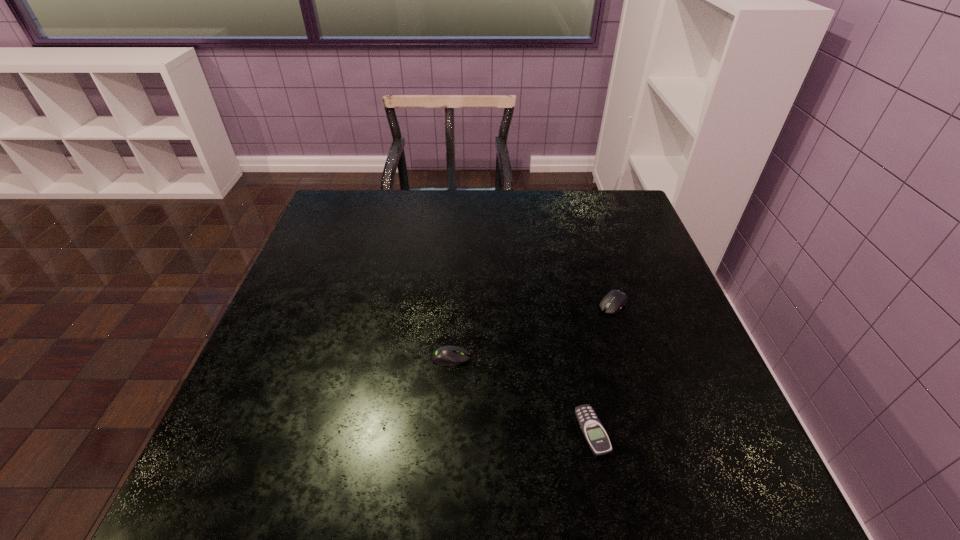
The image size is (960, 540). I want to click on free space between the nearest object and the rightmost object, so click(x=603, y=368).

Where is `unoccupied area between the second farthest object and the nearest object`? Image resolution: width=960 pixels, height=540 pixels. unoccupied area between the second farthest object and the nearest object is located at coordinates (521, 395).

The image size is (960, 540). Find the location of `free space between the leftmost object and the beeper`. free space between the leftmost object and the beeper is located at coordinates (521, 395).

Where is `free space between the leftmost object and the second object from right to left`? free space between the leftmost object and the second object from right to left is located at coordinates (521, 395).

The width and height of the screenshot is (960, 540). In order to click on free area in between the rightmost object and the second nearest object in this screenshot , I will do `click(532, 331)`.

The width and height of the screenshot is (960, 540). Find the location of `unoccupied position between the right computer mouse and the second nearest object`. unoccupied position between the right computer mouse and the second nearest object is located at coordinates (532, 331).

Locate an element on the screen. vacant area that lies between the second nearest object and the farthest object is located at coordinates (532, 331).

The image size is (960, 540). In order to click on empty space between the beeper and the left computer mouse in this screenshot , I will do `click(521, 395)`.

Locate an element on the screen. Image resolution: width=960 pixels, height=540 pixels. object that is the second nearest to the second nearest object is located at coordinates (614, 300).

Locate which object is the closest to the farther computer mouse. Please provide its 2D coordinates. Your answer should be formatted as a tuple, i.e. [(x, y)], where the tuple contains the x and y coordinates of a point satisfying the conditions above.

[(594, 433)]